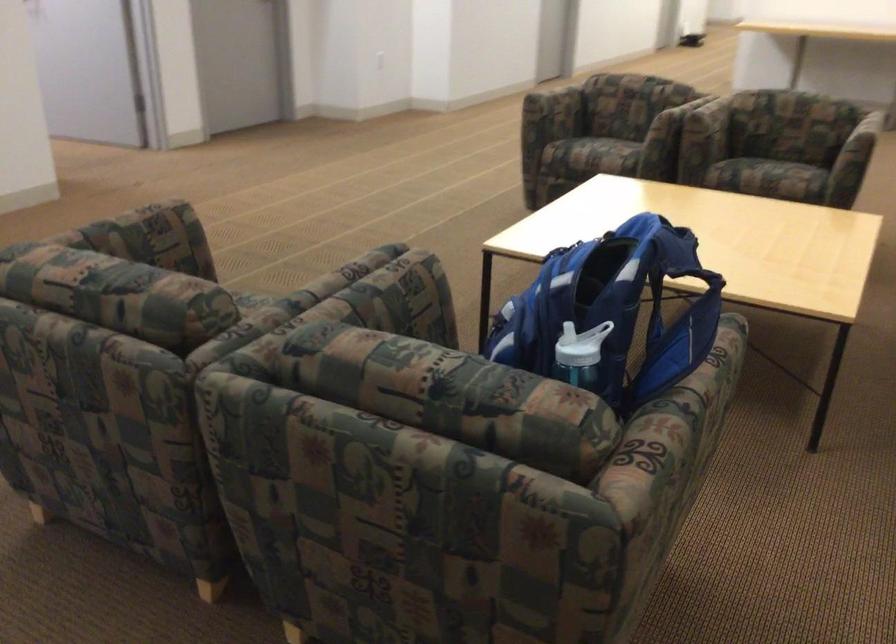
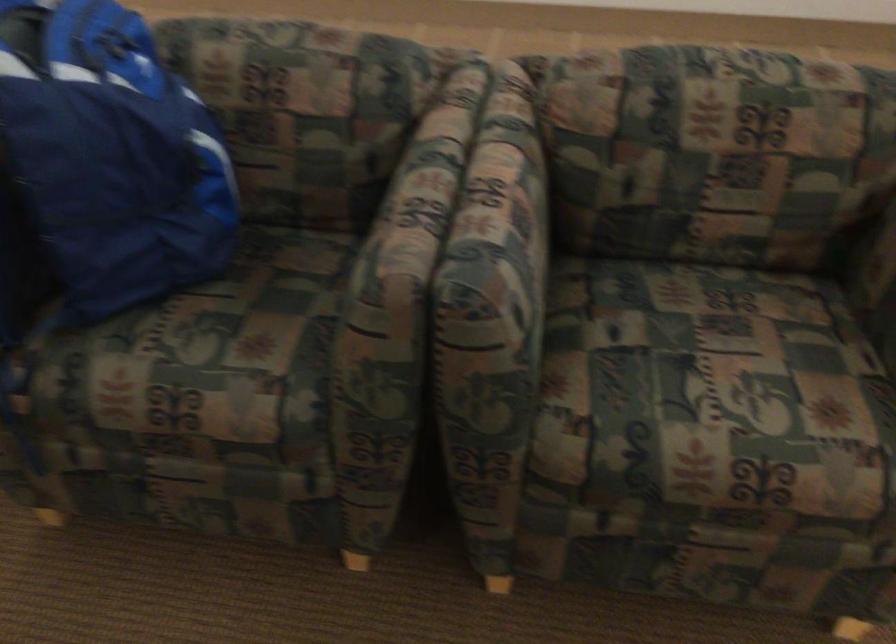
Where in the second image is the point corresponding to [328,270] from the first image?

(510, 196)